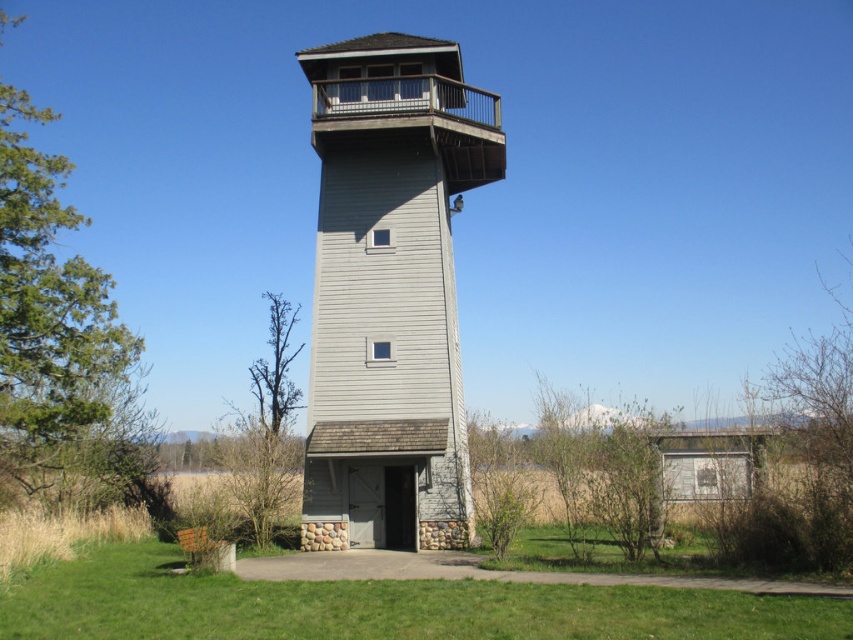
Question: Which point is farther to the camera?

Choices:
 (A) gray wood tower at center
 (B) green grass at lower center

Answer: (A)

Question: Considering the relative positions of gray wood tower at center and green grass at lower center in the image provided, where is gray wood tower at center located with respect to green grass at lower center?

Choices:
 (A) left
 (B) right

Answer: (B)

Question: Observing the image, what is the correct spatial positioning of gray wood tower at center in reference to green grass at lower center?

Choices:
 (A) right
 (B) left

Answer: (A)

Question: Which object is farther from the camera taking this photo?

Choices:
 (A) gray wood tower at center
 (B) green grass at lower center

Answer: (A)

Question: Can you confirm if gray wood tower at center is positioned below green grass at lower center?

Choices:
 (A) no
 (B) yes

Answer: (A)